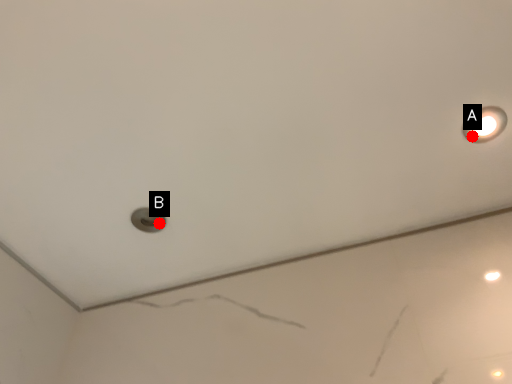
Question: Two points are circled on the image, labeled by A and B beside each circle. Which point is closer to the camera?

Choices:
 (A) A is closer
 (B) B is closer

Answer: (A)